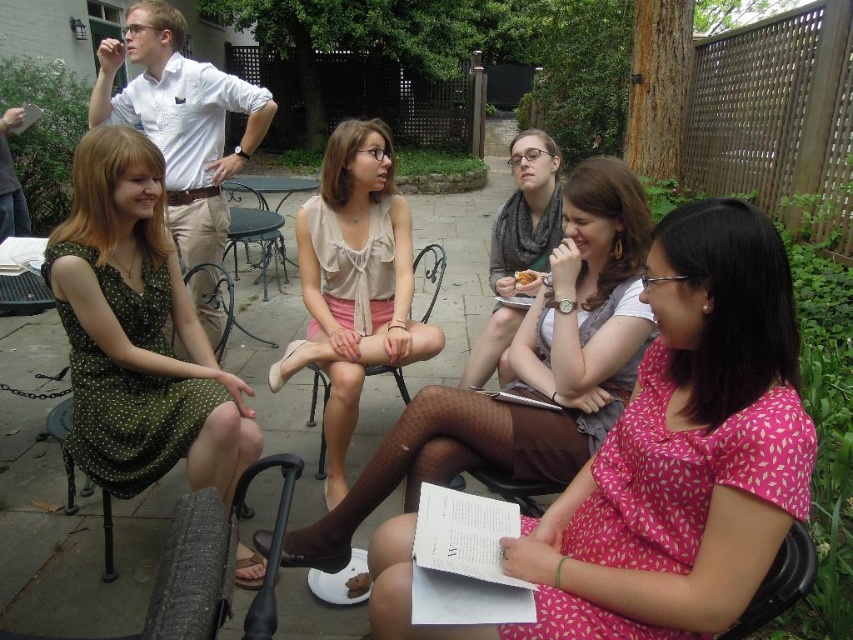
Question: Does beige chiffon blouse at center appear on the left side of golden crispy pastry at center?

Choices:
 (A) no
 (B) yes

Answer: (B)

Question: Does green dotted dress at left have a lesser width compared to metallic dark brown chair at center?

Choices:
 (A) yes
 (B) no

Answer: (A)

Question: Does gray scarf at center have a lesser width compared to brown crumbly cookie at lower center?

Choices:
 (A) no
 (B) yes

Answer: (A)

Question: Which object is positioned closest to the metallic dark brown chair at center?

Choices:
 (A) pink printed dress at center
 (B) gray scarf at center

Answer: (B)

Question: Which point is closer to the camera?

Choices:
 (A) (519, 285)
 (B) (491, 280)
 (C) (251, 264)

Answer: (A)

Question: Which point is closer to the camera taking this photo?

Choices:
 (A) (431, 278)
 (B) (264, 266)
 (C) (119, 376)
 (D) (521, 237)

Answer: (C)